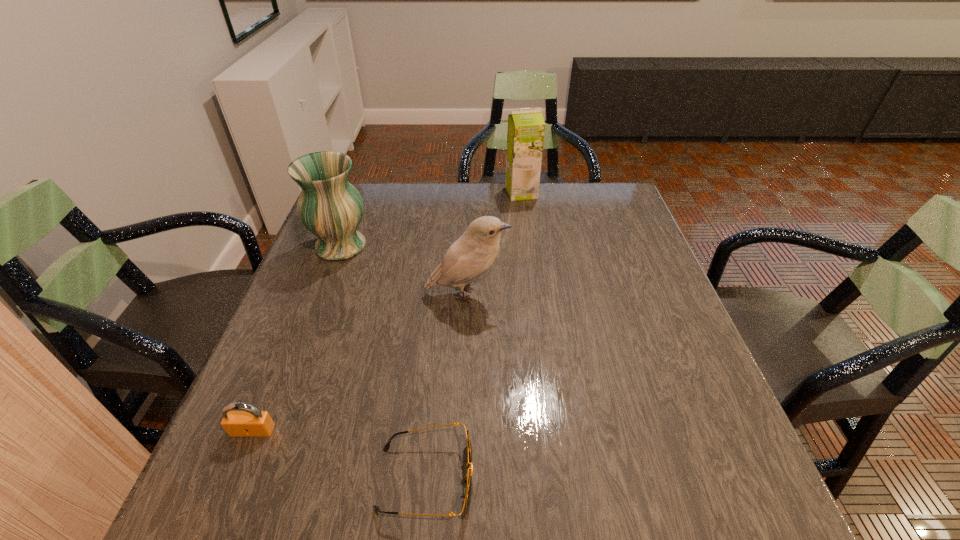
Find the location of `soya milk`. soya milk is located at coordinates (525, 136).

Where is `the farthest object`? The image size is (960, 540). the farthest object is located at coordinates (525, 136).

This screenshot has width=960, height=540. Identify the location of vase. (331, 208).

At what (x,y) coordinates should I click in order to perform the action: click on the third nearest object. Please return your answer as a coordinate pair (x, y). Looking at the image, I should click on (474, 252).

The image size is (960, 540). I want to click on the second shortest object, so click(x=248, y=422).

Identify the location of the shortest object. This screenshot has width=960, height=540. point(467,479).

Identify the location of vacant area located 0.350m on the front of the soya milk. The width and height of the screenshot is (960, 540). coord(532,276).

Where is `free space located on the front of the vase`? This screenshot has width=960, height=540. free space located on the front of the vase is located at coordinates (289, 382).

The width and height of the screenshot is (960, 540). Identify the location of vacant region located at the beak of the third nearest object. (650, 294).

Where is `vacant area situated 0.140m to unlock the padlock from the front`? vacant area situated 0.140m to unlock the padlock from the front is located at coordinates pos(215,522).